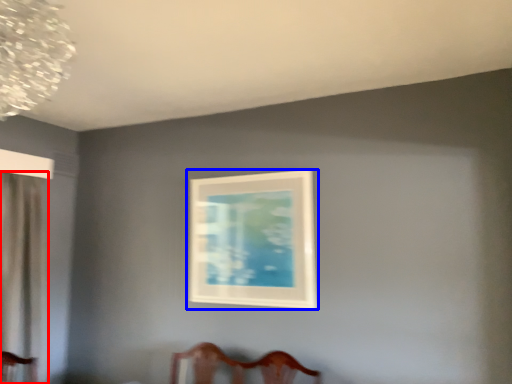
Question: Which object is closer to the camera taking this photo, curtain (highlighted by a red box) or picture frame (highlighted by a blue box)?

Choices:
 (A) curtain
 (B) picture frame

Answer: (A)